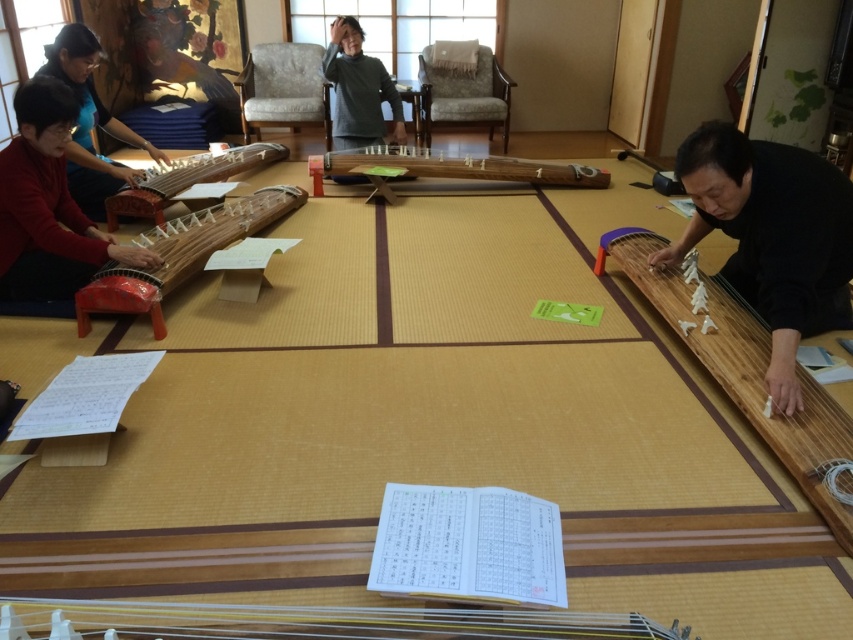
Does point (730, 374) come behind point (595, 180)?

No, it is in front of (595, 180).

Does wooden harp at right appear on the right side of wooden stringed instrument at center?

Correct, you'll find wooden harp at right to the right of wooden stringed instrument at center.

Which is behind, point (763, 397) or point (537, 170)?

The point (537, 170) is behind.

Where is `wooden harp at right`? Image resolution: width=853 pixels, height=640 pixels. wooden harp at right is located at coordinates (744, 371).

Which is behind, point (779, 192) or point (36, 275)?

Positioned behind is point (36, 275).

Is black matte guzheng at right thinner than matte red wood koto at left?

No.

Who is more forward, (x=805, y=252) or (x=79, y=236)?

Point (x=805, y=252)

Where is `black matte guzheng at right`? black matte guzheng at right is located at coordinates (770, 237).

Is gray matte sweater at center smaller than wooden polished koto at left?

Correct, gray matte sweater at center occupies less space than wooden polished koto at left.

Who is more forward, (x=374, y=99) or (x=207, y=172)?

Point (x=207, y=172) is in front.

Where is `gray matte sweater at center`? The width and height of the screenshot is (853, 640). gray matte sweater at center is located at coordinates (358, 90).

Identify the location of gray matte sweater at center. The height and width of the screenshot is (640, 853). (358, 90).